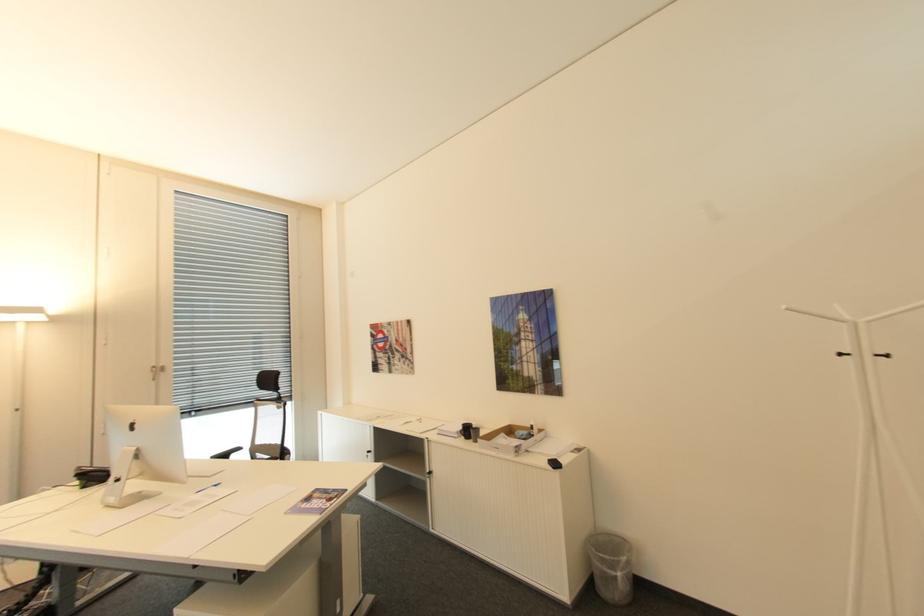
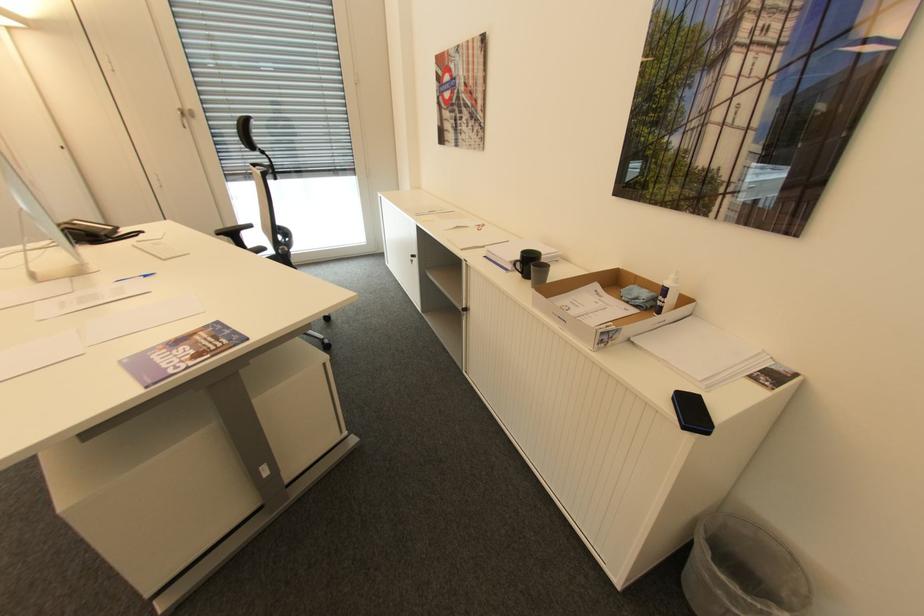
Find the pixel in the second image that matches (536,427) in the first image.

(670, 291)